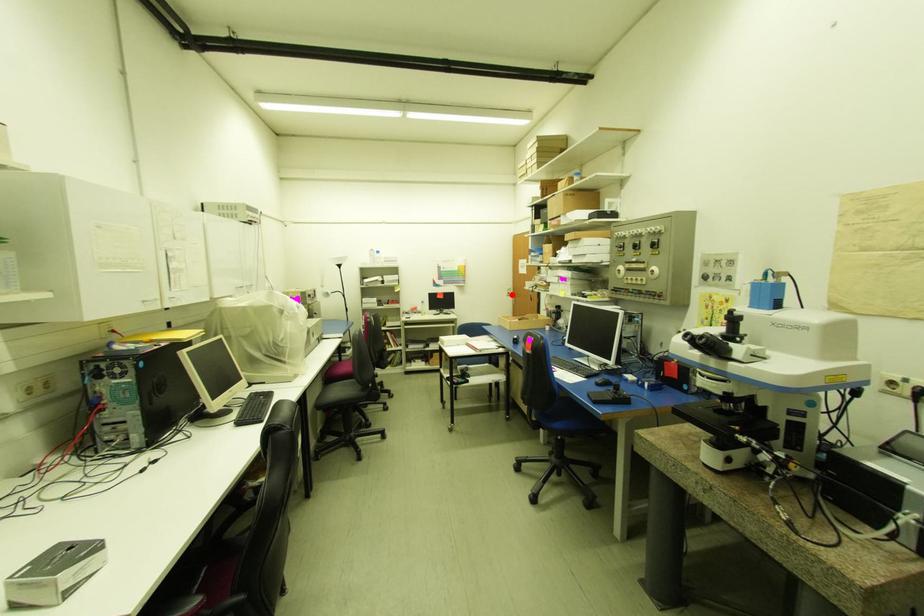
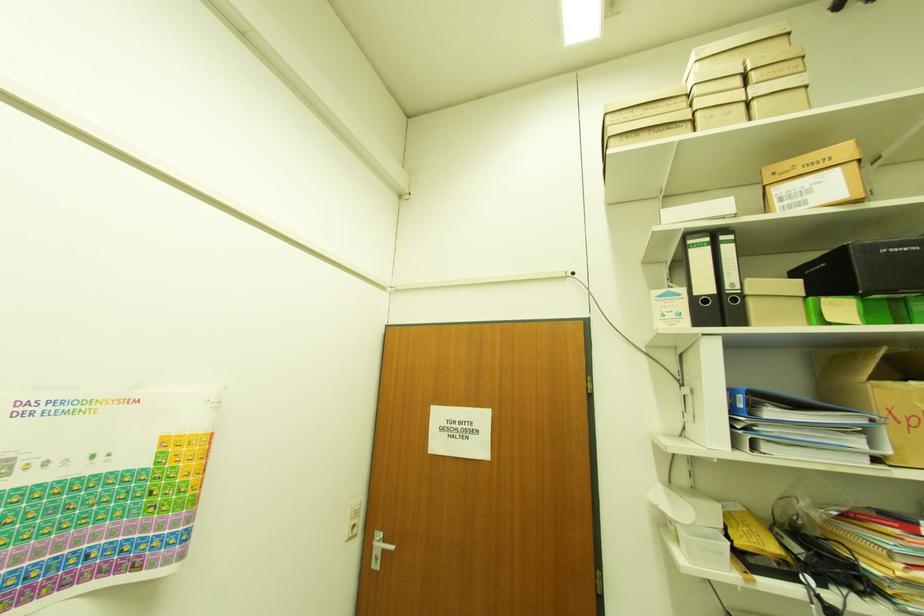
Where in the second image is the point corresponding to the highlighted location from the first image?

(357, 528)